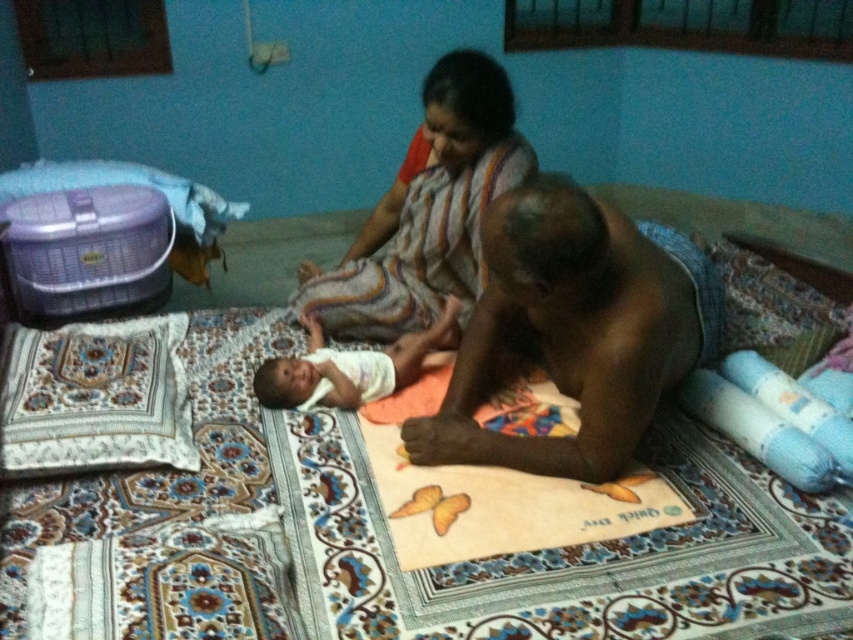
You are a photographer trying to capture a candid shot of the dark skin man at center and the white cloth at center in the scene. You need to ensure that both subjects are in focus simultaneously. Given that your camera has a depth of field that can cover up to 40 centimeters, will you be able to achieve this?

The distance between the dark skin man at center and the white cloth at center is 38.48 centimeters, which is within the camera depth of field of 40 centimeters. Therefore, you can capture both subjects in focus simultaneously.